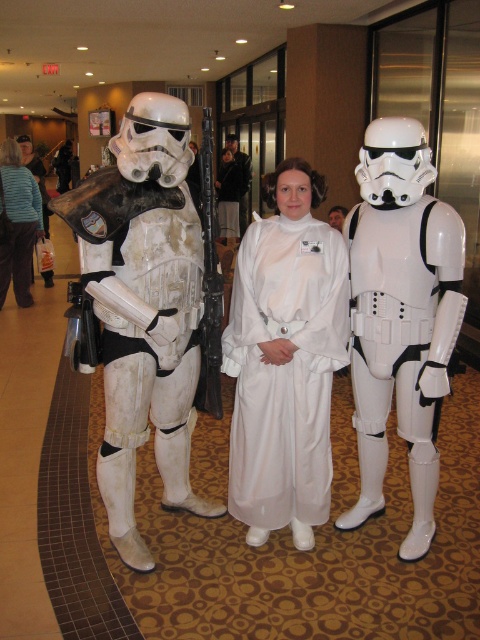
You are a photographer setting up for a group photo in the lobby. You have two props to place in the scene. The white matte stormtrooper armor at left needs to be positioned so it doesn not block the white matte helmet at center. Given their sizes, which prop should you place first to ensure proper positioning?

The white matte stormtrooper armor at left is bigger than the white matte helmet at center, so you should place the white matte stormtrooper armor at left first to ensure it doesn not block the smaller helmet.

You are standing in the hotel lobby and see the white matte stormtrooper armor at left. Where is it located in the image?

The white matte stormtrooper armor at left is located at point (x=142, y=326) in the image.